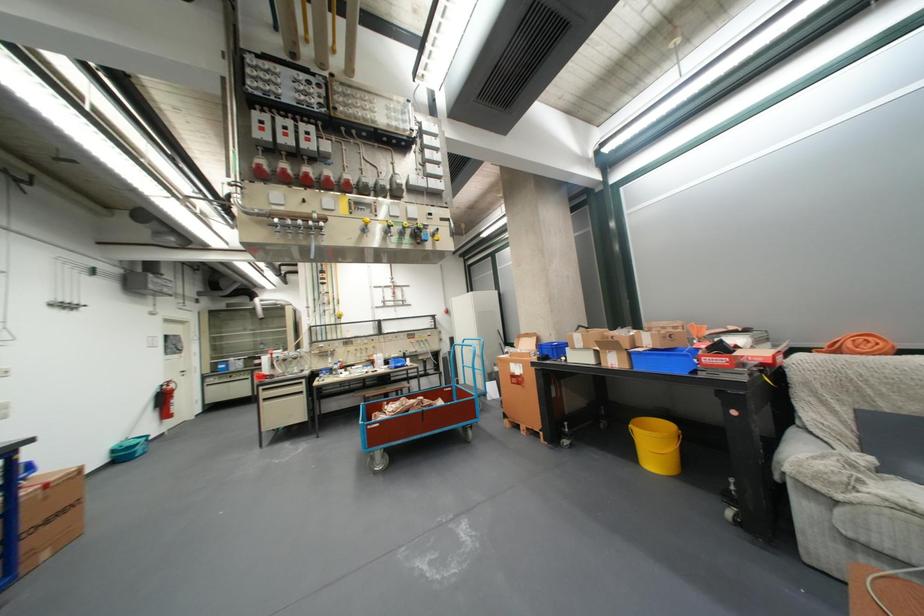
Describe the element at coordinates (861, 475) in the screenshot. I see `the sofa sitting surface` at that location.